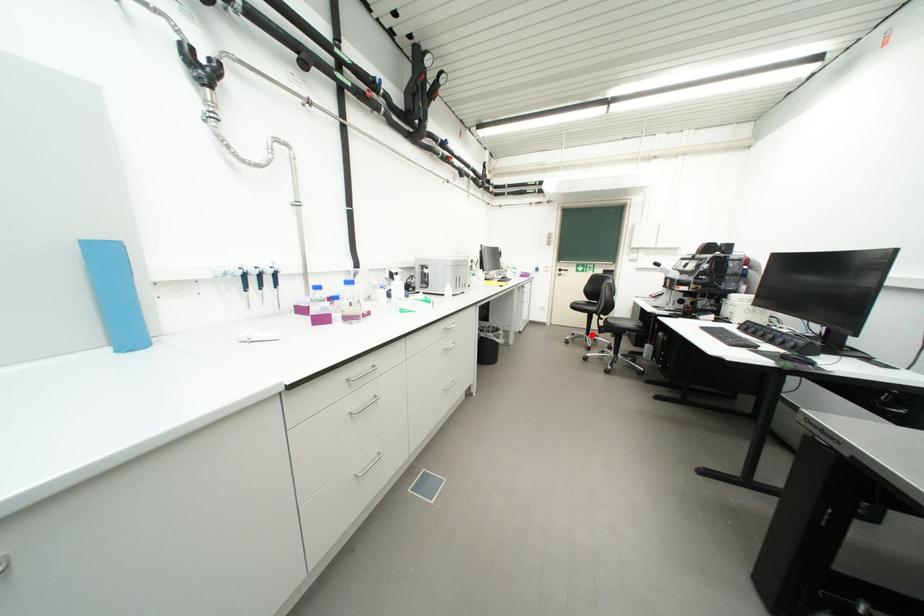
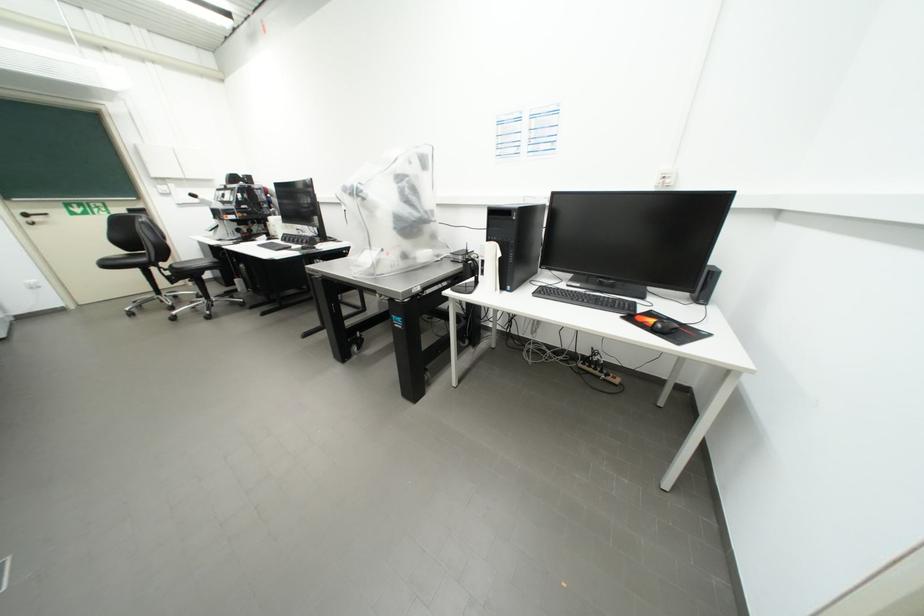
Where in the second image is the point corresponding to the highlighted location from the first image?

(160, 296)